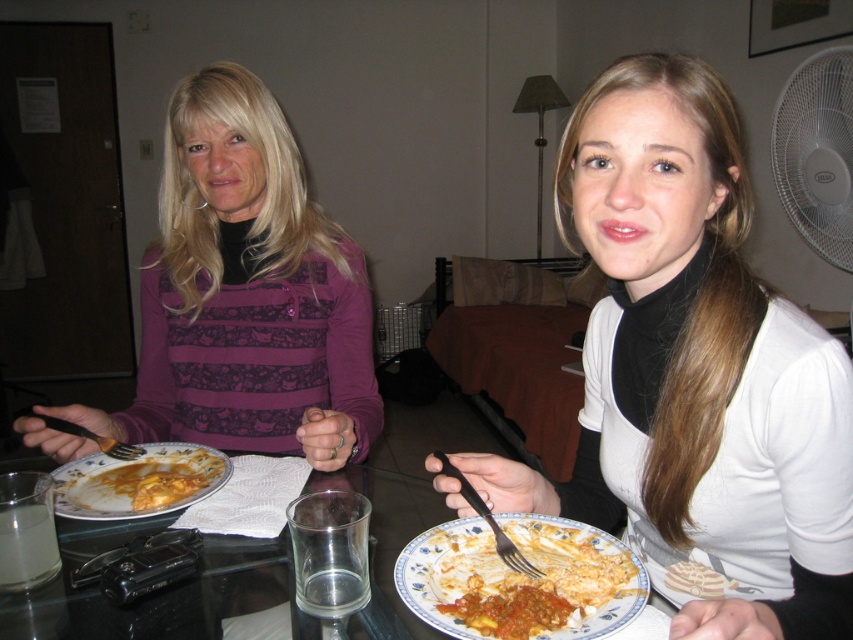
Does porcelain floral plate at lower center appear under white ceramic plate at lower left?

A: Correct, porcelain floral plate at lower center is located below white ceramic plate at lower left.

Can you confirm if porcelain floral plate at lower center is smaller than white ceramic plate at lower left?

No, porcelain floral plate at lower center is not smaller than white ceramic plate at lower left.

Which is in front, point (569, 604) or point (115, 515)?

Point (569, 604)

The image size is (853, 640). I want to click on porcelain floral plate at lower center, so click(521, 573).

At what (x,y) coordinates should I click in order to perform the action: click on white matte shirt at center. Please return your answer as a coordinate pair (x, y). This screenshot has width=853, height=640. Looking at the image, I should click on (694, 372).

Does white matte shirt at center have a larger size compared to white ceramic plate at lower left?

Indeed, white matte shirt at center has a larger size compared to white ceramic plate at lower left.

The width and height of the screenshot is (853, 640). In order to click on white matte shirt at center in this screenshot , I will do `click(694, 372)`.

Can you confirm if white ceramic plate at lower left is positioned to the right of tomato sauce pasta at lower center?

No, white ceramic plate at lower left is not to the right of tomato sauce pasta at lower center.

Who is more distant from viewer, (149,504) or (474,573)?

The point (149,504) is behind.

Locate an element on the screen. white ceramic plate at lower left is located at coordinates (138, 481).